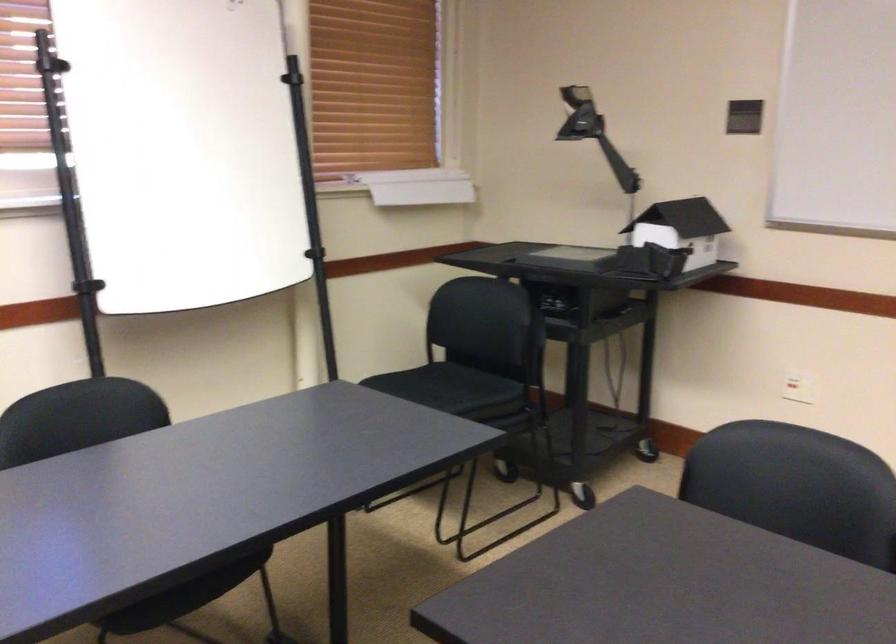
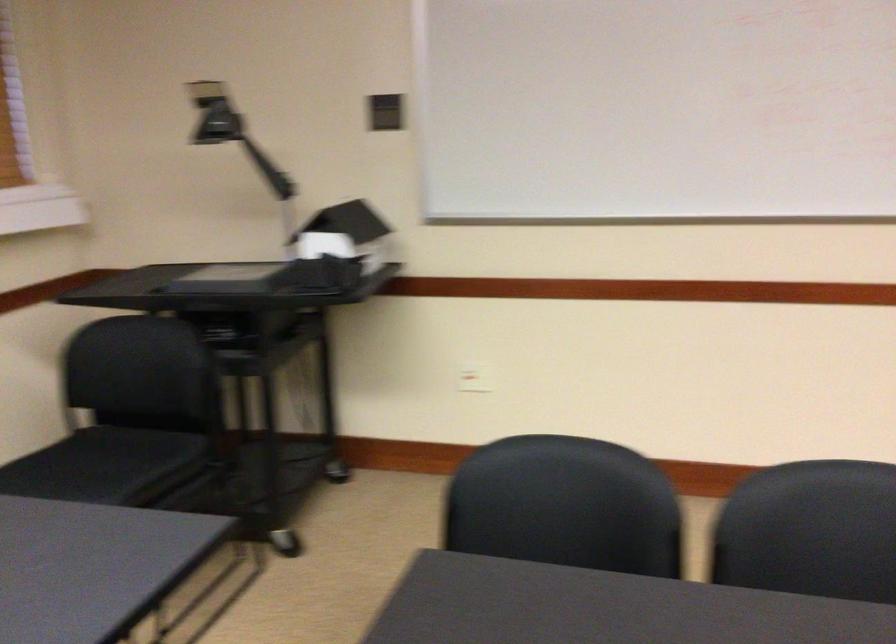
Which direction would the cameraman need to move to produce the second image?

The cameraman walked toward left, forward.